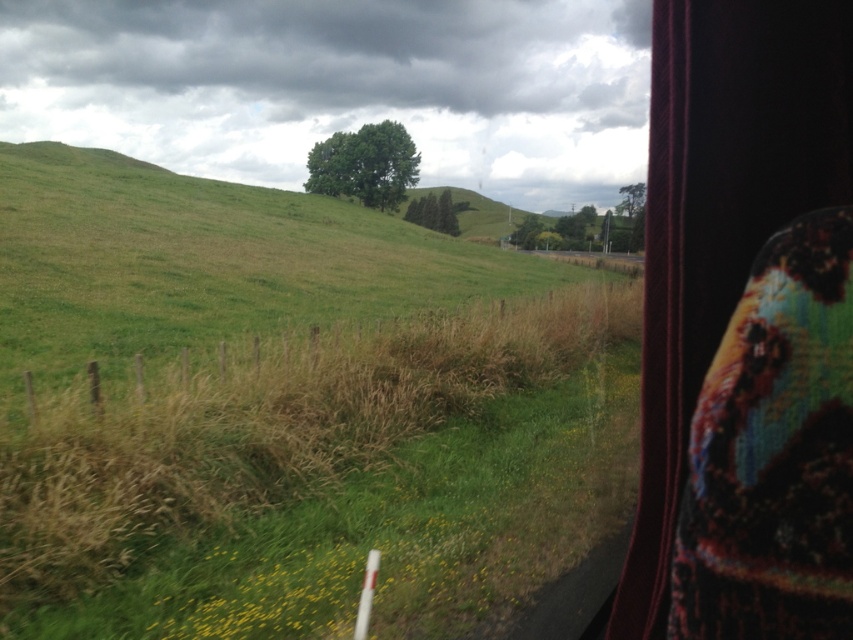
Based on the photo, you are a photographer trying to capture the green grassy hillside at center and the green matte tree at center in a single shot. Which object will occupy more space in your photo?

The green grassy hillside at center is bigger than the green matte tree at center, so it will occupy more space in the photo.

You are sitting in the vehicle and want to adjust the velvet dark curtain at right to get a better view of the midground tree. Based on its current position, can you move the curtain to the left without obstructing the view of the tree?

The velvet dark curtain at right is located at point (721, 212), which means moving it to the left would not obstruct the view of the midground tree since it is positioned to the right side of the window.